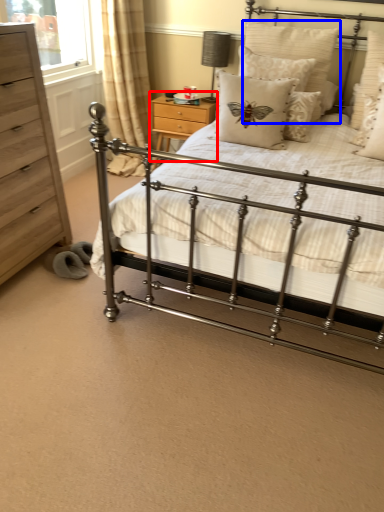
Question: Which point is further to the camera, nightstand (highlighted by a red box) or pillow (highlighted by a blue box)?

Choices:
 (A) nightstand
 (B) pillow

Answer: (A)